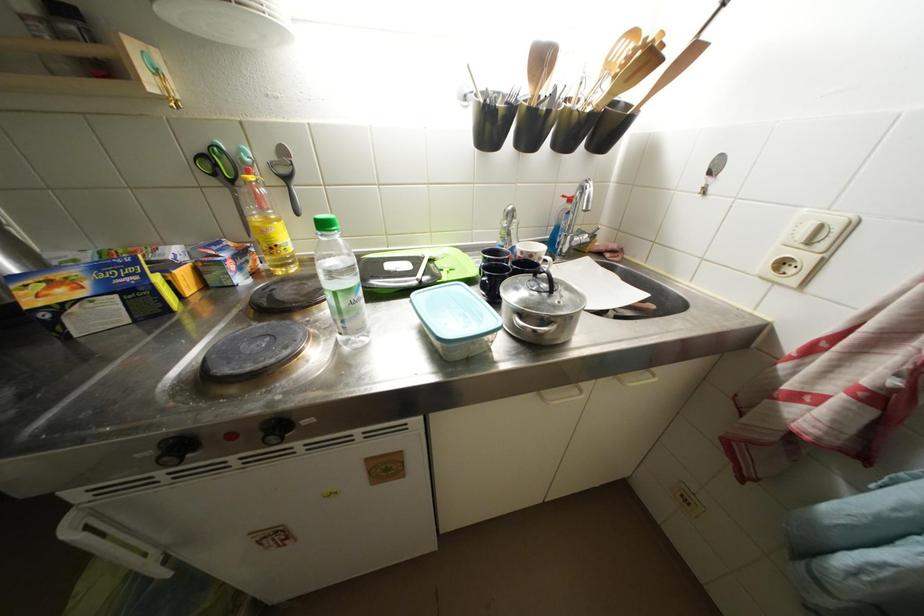
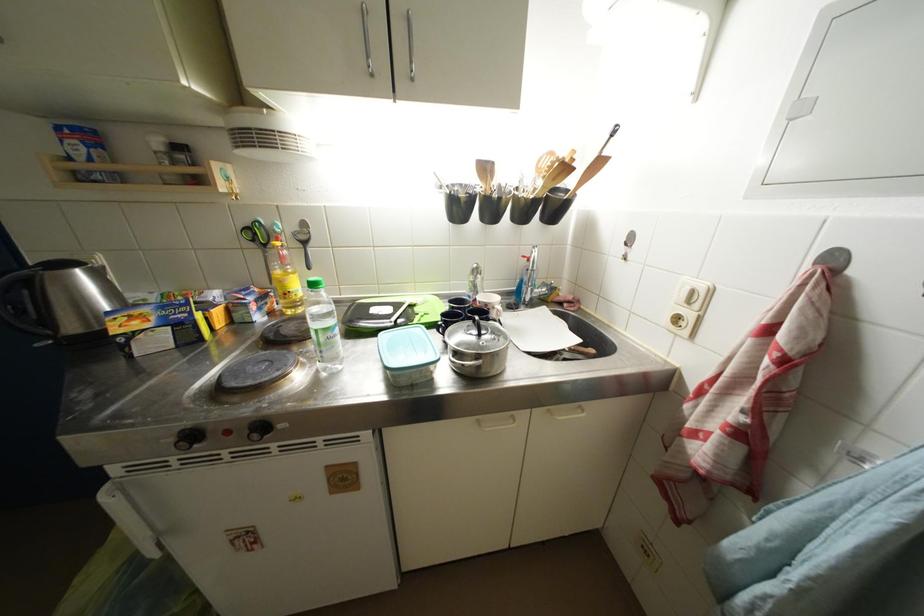
Locate, in the second image, the point that corresponds to pixel 419 300 in the first image.

(386, 339)